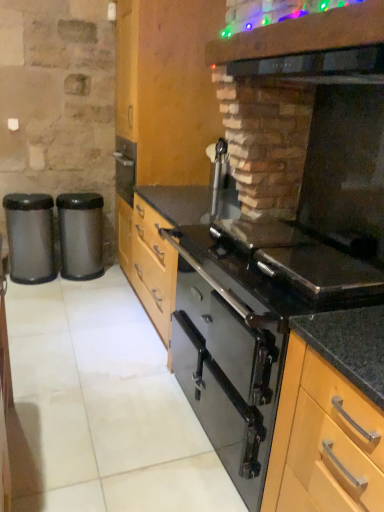
The width and height of the screenshot is (384, 512). Find the location of `blank space situated above metallic trash can at left, marked as the second waste container in a right-to-left arrangement (from a real-world perspective)`. blank space situated above metallic trash can at left, marked as the second waste container in a right-to-left arrangement (from a real-world perspective) is located at coordinates (23, 196).